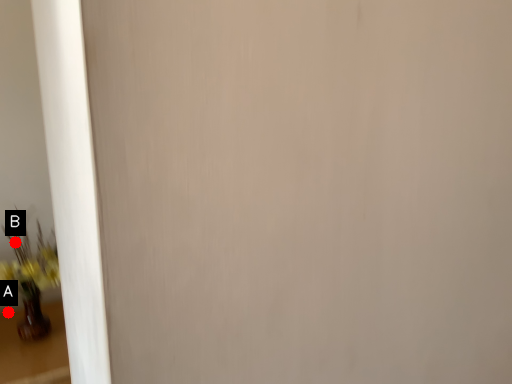
Question: Two points are circled on the image, labeled by A and B beside each circle. Among these points, which one is nearest to the camera?

Choices:
 (A) A is closer
 (B) B is closer

Answer: (A)